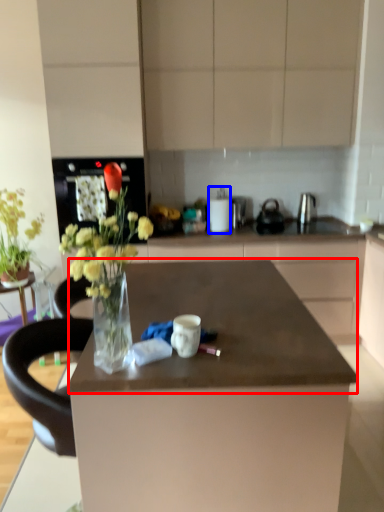
Question: Which object is further to the camera taking this photo, countertop (highlighted by a red box) or appliance (highlighted by a blue box)?

Choices:
 (A) countertop
 (B) appliance

Answer: (B)